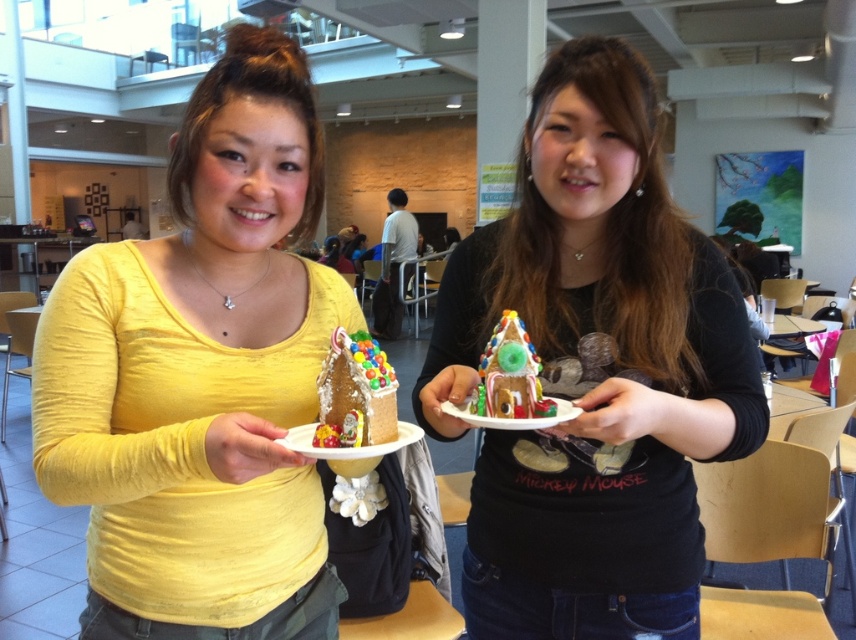
Question: Which object appears farthest from the camera in this image?

Choices:
 (A) glossy gingerbread house at center
 (B) gingerbread house at center
 (C) matte gingerbread house at center

Answer: (A)

Question: Which of these objects is positioned closest to the yellow matte shirt at center?

Choices:
 (A) glossy gingerbread house at center
 (B) matte gingerbread house at center
 (C) matte brown gingerbread house at center

Answer: (B)

Question: Can you confirm if yellow matte shirt at center is positioned to the right of matte brown gingerbread house at center?

Choices:
 (A) yes
 (B) no

Answer: (B)

Question: From the image, what is the correct spatial relationship of yellow matte shirt at center in relation to matte brown gingerbread house at center?

Choices:
 (A) right
 (B) left

Answer: (B)

Question: Which object is closer to the camera taking this photo?

Choices:
 (A) yellow matte shirt at center
 (B) glossy gingerbread house at center
 (C) matte gingerbread house at center
 (D) matte brown gingerbread house at center

Answer: (C)

Question: Can you confirm if yellow matte shirt at center is smaller than matte brown gingerbread house at center?

Choices:
 (A) yes
 (B) no

Answer: (A)